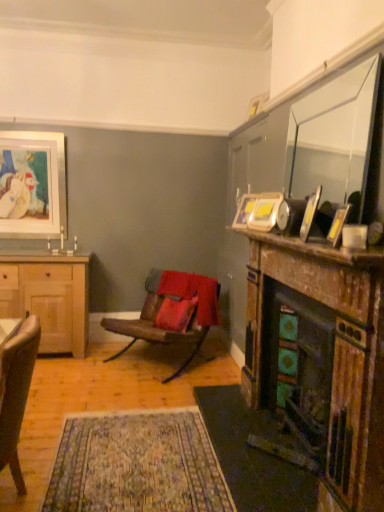
At what (x,y) coordinates should I click in order to perform the action: click on vacant point above dark brown textured rug at lower center (from a real-world perspective). Please return your answer as a coordinate pair (x, y). This screenshot has width=384, height=512. Looking at the image, I should click on (260, 444).